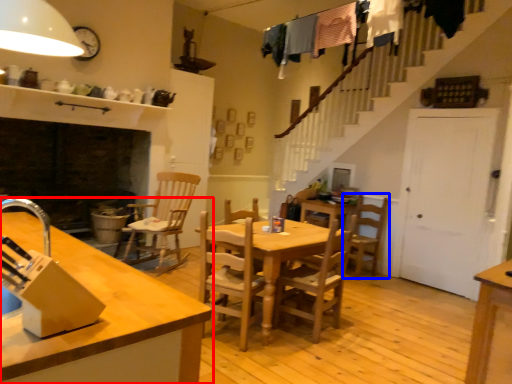
Question: Among these objects, which one is nearest to the camera, countertop (highlighted by a red box) or chair (highlighted by a blue box)?

Choices:
 (A) countertop
 (B) chair

Answer: (A)